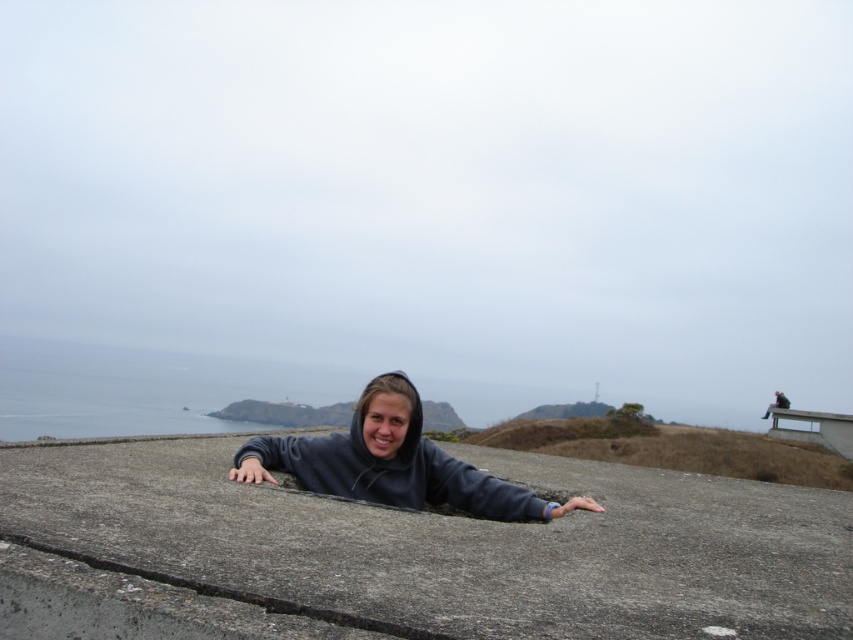
You are a photographer trying to capture the scene from above. You notice the gray concrete at center and the dark gray hoodie at center. Which object is positioned lower in the image?

The gray concrete at center is located below the dark gray hoodie at center, so it is positioned lower in the image.

You are a photographer trying to capture the scene with the gray concrete at center and the dark gray hoodie at center. Which object should you focus on first if you want to ensure both are in sharp focus?

You should focus on the gray concrete at center first because it is closer to you than the dark gray hoodie at center, ensuring both will be in focus when using a shallow depth of field.

You are a photographer trying to capture the perfect shot of the gray concrete at center and the dark gray hoodie at center. You need to ensure that both objects are in focus simultaneously. Given that your camera has a depth of field that can cover 5 feet, will you be able to achieve this?

The gray concrete at center and dark gray hoodie at center are 4.61 feet apart. Since the distance between them is less than the 5 feet depth of field, the camera can keep both in focus simultaneously.